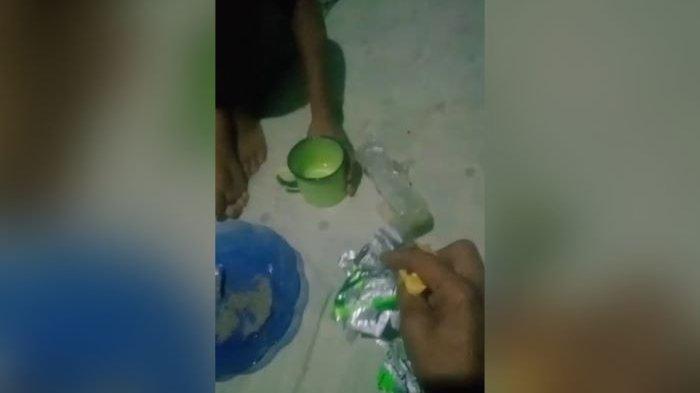
At what (x,y) coordinates should I click in order to perform the action: click on blue plate. Please return your answer as a coordinate pair (x, y). This screenshot has width=700, height=393. Looking at the image, I should click on (260, 309).